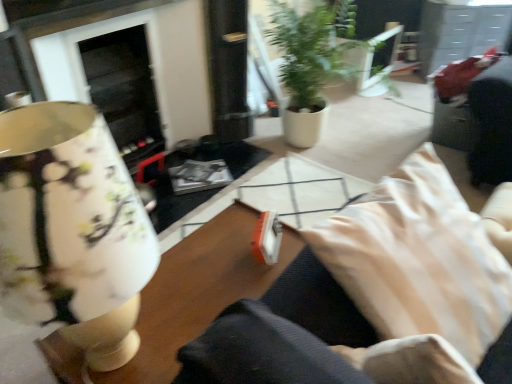
Question: From the image's perspective, relative to beige fabric pillow at lower right, is wooden table at center above or below?

Choices:
 (A) below
 (B) above

Answer: (A)

Question: Considering the positions of wooden table at center and beige fabric pillow at lower right in the image, is wooden table at center taller or shorter than beige fabric pillow at lower right?

Choices:
 (A) tall
 (B) short

Answer: (A)

Question: Estimate the real-world distances between objects in this image. Which object is farther from the beige fabric pillow at lower right?

Choices:
 (A) wooden table at center
 (B) green matte plant at center
 (C) matte floral lampshade at left

Answer: (B)

Question: Which of these objects is positioned farthest from the wooden table at center?

Choices:
 (A) green matte plant at center
 (B) beige fabric pillow at lower right
 (C) matte floral lampshade at left

Answer: (A)